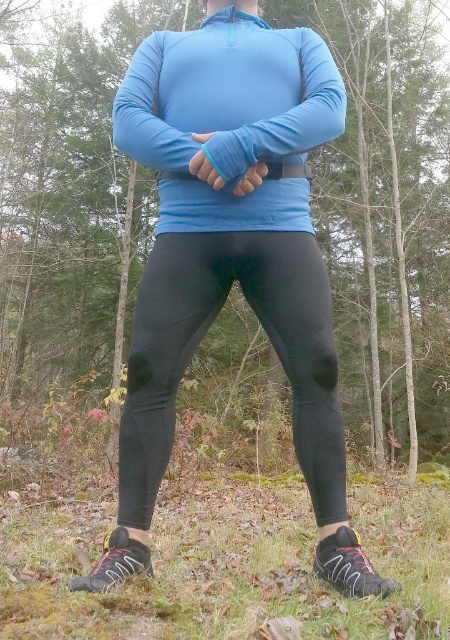
Question: Which point is farther to the camera?

Choices:
 (A) matte black leggings at center
 (B) black matte leggings at center
 (C) matte blue long-sleeve shirt at center

Answer: (A)

Question: Can you confirm if matte blue long-sleeve shirt at center is positioned to the right of black matte leggings at center?

Choices:
 (A) no
 (B) yes

Answer: (B)

Question: Which object is the farthest from the matte blue long-sleeve shirt at center?

Choices:
 (A) matte black leggings at center
 (B) black matte leggings at center

Answer: (A)

Question: Which of these objects is positioned farthest from the matte blue long-sleeve shirt at center?

Choices:
 (A) black matte leggings at center
 (B) matte black leggings at center

Answer: (B)

Question: Is the position of matte black leggings at center less distant than that of matte blue long-sleeve shirt at center?

Choices:
 (A) yes
 (B) no

Answer: (B)

Question: Is matte black leggings at center below matte blue long-sleeve shirt at center?

Choices:
 (A) no
 (B) yes

Answer: (A)